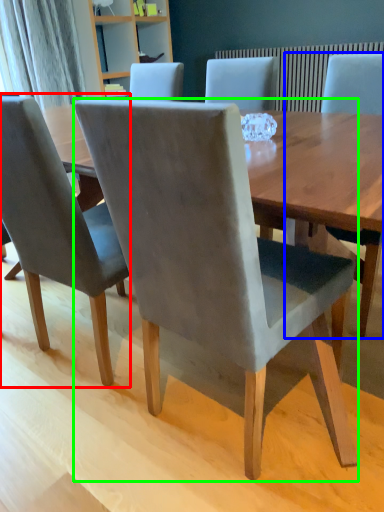
Question: Considering the real-world distances, which object is farthest from chair (highlighted by a red box)? chair (highlighted by a blue box) or chair (highlighted by a green box)?

Choices:
 (A) chair
 (B) chair

Answer: (A)